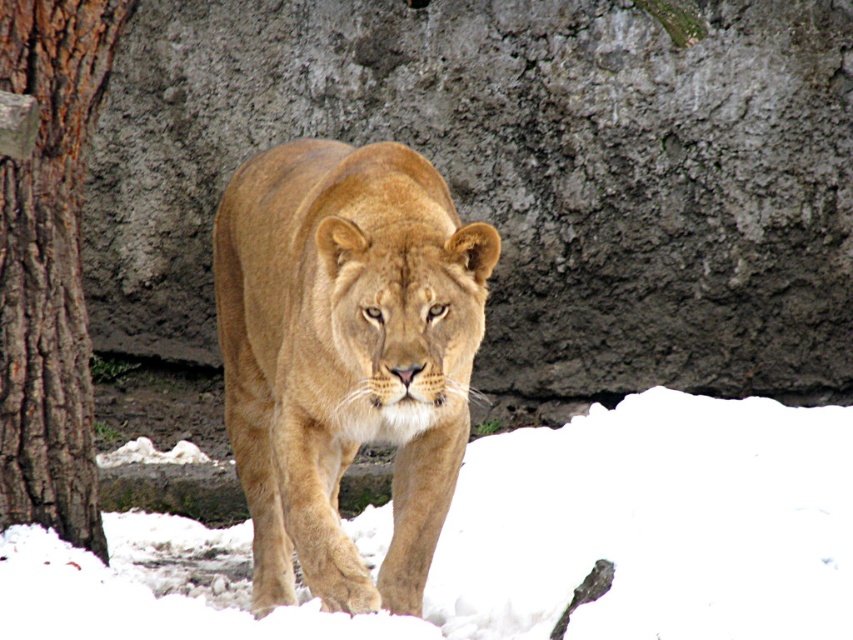
You are a photographer positioned in front of the lioness. You want to take a photo focusing on the white fluffy snow at center and the brown rough bark at left. Which object will appear larger in the photo?

The white fluffy snow at center will appear larger in the photo because it is closer to the viewer than the brown rough bark at left.

You are a wildlife photographer observing the golden fur lion at center and the brown rough bark at left in the snowy environment. Which object is positioned lower in the image?

The golden fur lion at center is located below the brown rough bark at left, so it is positioned lower in the image.